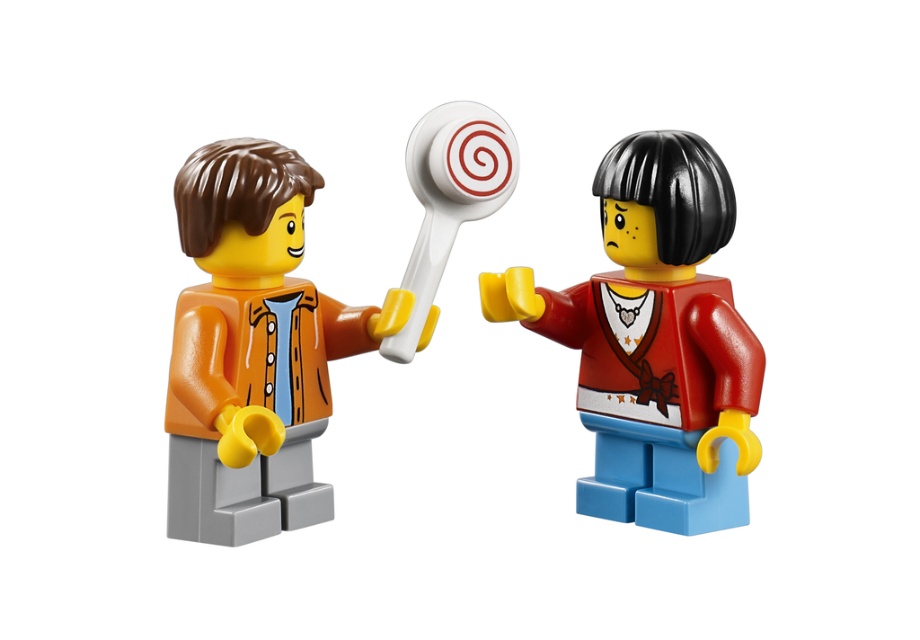
Question: Which point is closer to the camera taking this photo?

Choices:
 (A) (483, 115)
 (B) (608, 321)

Answer: (A)

Question: Estimate the real-world distances between objects in this image. Which object is farther from the matte orange shirt at left?

Choices:
 (A) white plastic lollipop at center
 (B) smooth red sweater at center

Answer: (B)

Question: Which of the following is the closest to the observer?

Choices:
 (A) white plastic lollipop at center
 (B) smooth red sweater at center

Answer: (B)

Question: Considering the relative positions of smooth red sweater at center and matte orange shirt at left in the image provided, where is smooth red sweater at center located with respect to matte orange shirt at left?

Choices:
 (A) below
 (B) above

Answer: (A)

Question: Does smooth red sweater at center have a smaller size compared to white plastic lollipop at center?

Choices:
 (A) no
 (B) yes

Answer: (A)

Question: Does smooth red sweater at center have a lesser width compared to white plastic lollipop at center?

Choices:
 (A) no
 (B) yes

Answer: (A)